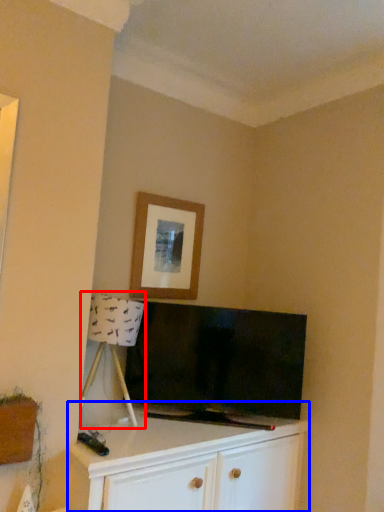
Question: Which of the following is the farthest to the observer, lamp (highlighted by a red box) or cabinetry (highlighted by a blue box)?

Choices:
 (A) lamp
 (B) cabinetry

Answer: (A)